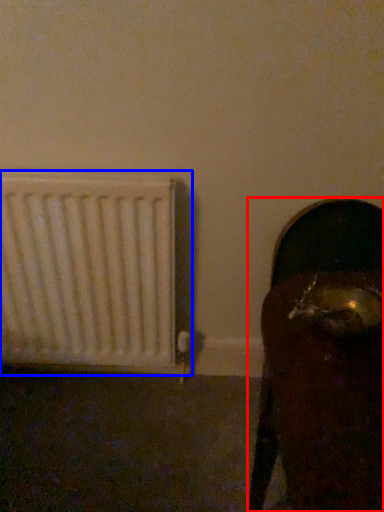
Question: Which point is further to the camera, furniture (highlighted by a red box) or radiator (highlighted by a blue box)?

Choices:
 (A) furniture
 (B) radiator

Answer: (B)